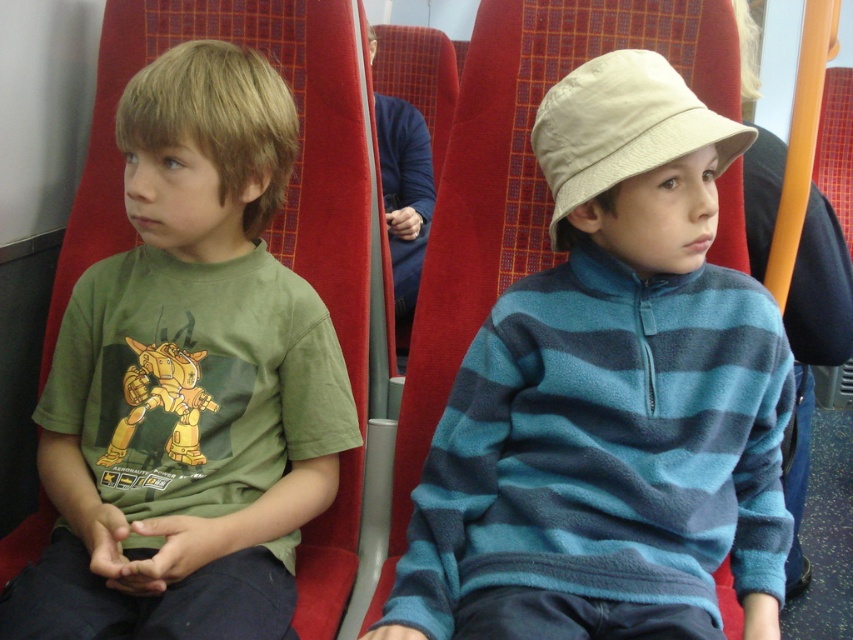
You are a passenger in a train car and want to place a small backpack on the seat next to you. The seat has a coordinate system where the bottom left corner is the origin. The blue striped fleece at center is already placed at point (610,400). Can you place your backpack at point 0.5, 0.5 without overlapping the fleece?

The blue striped fleece at center is located at point (610,400). Since the backpack is placed at 0.5, 0.5, which is to the left and below the fleece, there should be no overlap between the backpack and the fleece.

You are a parent trying to locate your child who is wearing a blue striped fleece at center and sitting next to another child in a green cotton shirt at left. Based on the scene description, which direction should you look to find them?

The blue striped fleece at center is to the right of the green cotton shirt at left, so you should look towards the right side of the seating area where the green cotton shirt at left is located to find both children.

You are a passenger sitting behind the two children in the train. You want to know which object is taller between the green cotton shirt at left and the beige fabric hat at center. Can you tell me?

The green cotton shirt at left is much taller than the beige fabric hat at center.